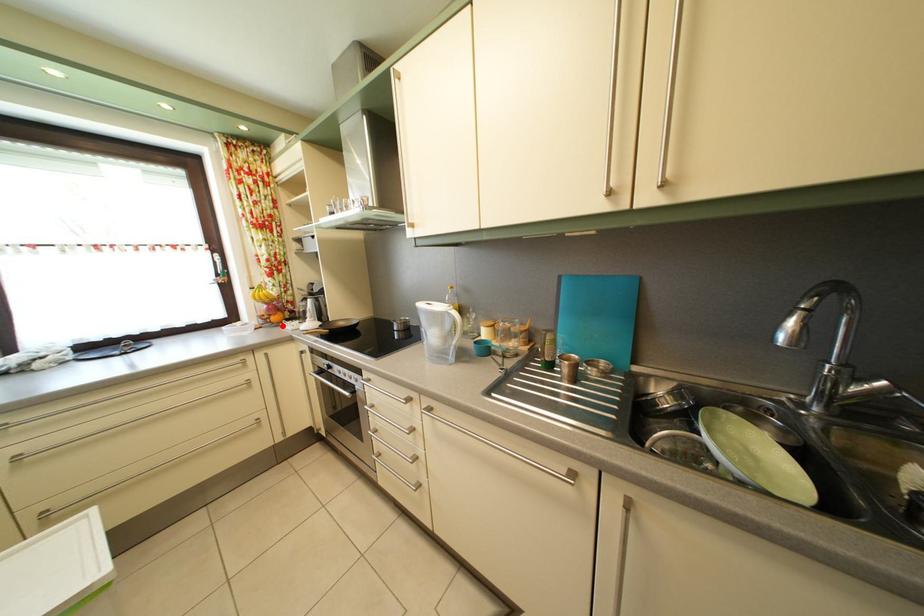
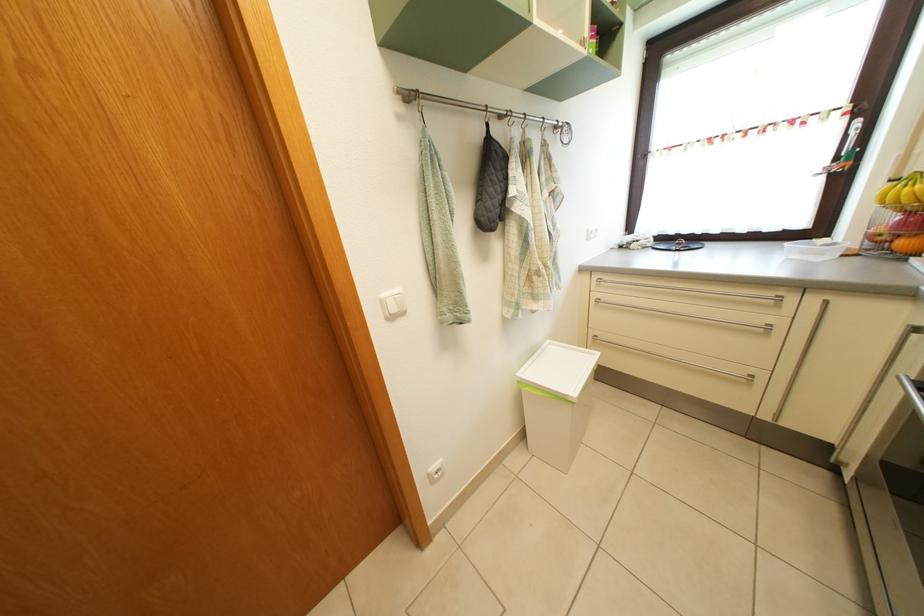
Question: I am providing you with two images of the same scene from different viewpoints. Given a red point in image1, look at the same physical point in image2. Is it:

Choices:
 (A) Closer to the viewpoint
 (B) Farther from the viewpoint

Answer: (B)